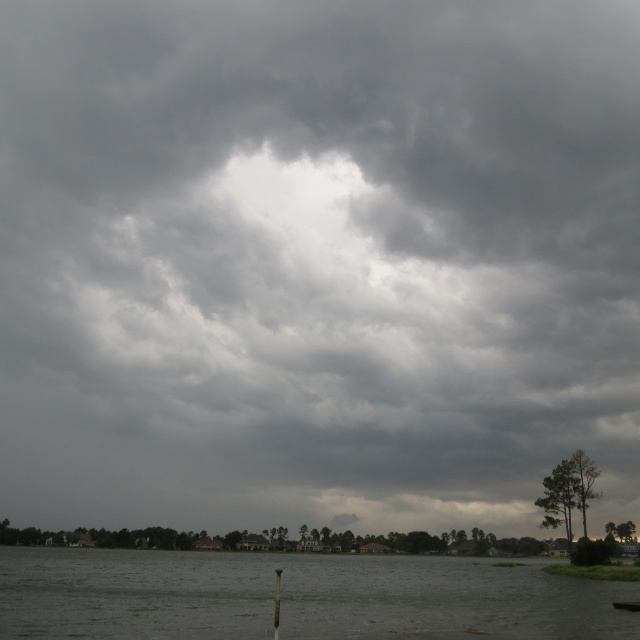
Question: Where is gray matte water at lower center located in relation to dark gray metallic boat at lower right in the image?

Choices:
 (A) right
 (B) left

Answer: (B)

Question: Which object appears closest to the camera in this image?

Choices:
 (A) dark gray metallic boat at lower right
 (B) gray matte water at lower center

Answer: (B)

Question: Can you confirm if gray matte water at lower center is positioned below dark gray metallic boat at lower right?

Choices:
 (A) yes
 (B) no

Answer: (A)

Question: Can you confirm if gray matte water at lower center is thinner than dark gray metallic boat at lower right?

Choices:
 (A) yes
 (B) no

Answer: (B)